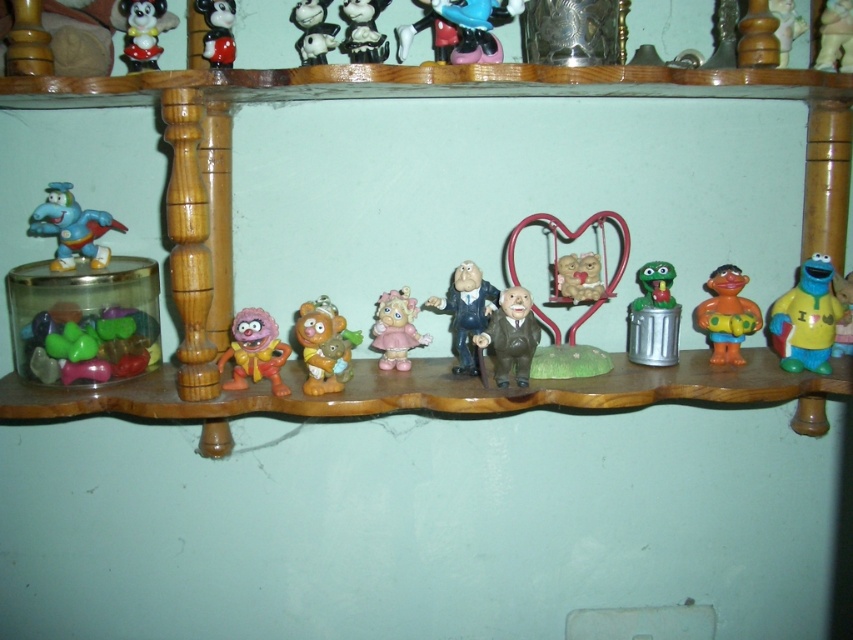
Question: Which point is farther from the camera taking this photo?

Choices:
 (A) (740, 83)
 (B) (340, 339)

Answer: (B)

Question: Can you confirm if shiny silver figurine at center is wider than smooth plastic mickey mouse at upper center?

Choices:
 (A) yes
 (B) no

Answer: (B)

Question: Which point appears farthest from the camera in this image?

Choices:
 (A) (778, 54)
 (B) (751, 77)
 (C) (828, 45)
 (D) (515, 3)

Answer: (C)

Question: Which object is the closest to the shiny silver figurine at center?

Choices:
 (A) matte plastic cookie at center
 (B) yellow matte cookie monster at right
 (C) pink rubber toy at center

Answer: (C)

Question: Observing the image, what is the correct spatial positioning of wooden shelf at center in reference to shiny blue plastic dinosaur at left?

Choices:
 (A) above
 (B) below

Answer: (B)

Question: Does yellow matte cookie monster at right appear on the right side of orange matte bear at center?

Choices:
 (A) yes
 (B) no

Answer: (A)